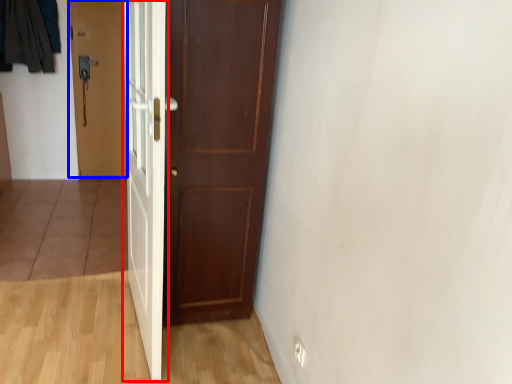
Question: Which object is closer to the camera taking this photo, door (highlighted by a red box) or door (highlighted by a blue box)?

Choices:
 (A) door
 (B) door

Answer: (A)